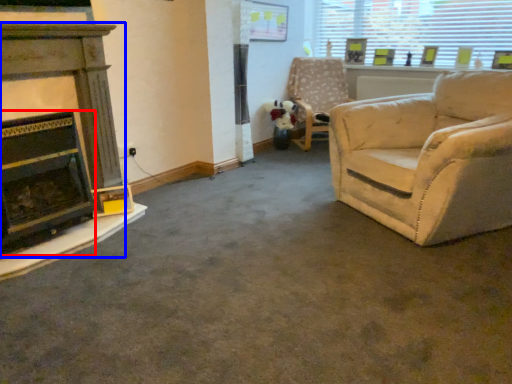
Question: Which of the following is the closest to the observer, fireplace (highlighted by a red box) or fireplace (highlighted by a blue box)?

Choices:
 (A) fireplace
 (B) fireplace

Answer: (A)